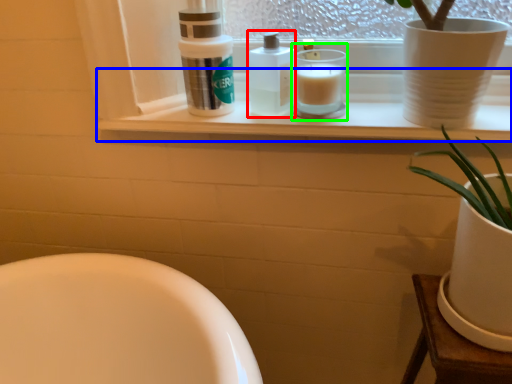
Question: Which object is the farthest from toiletry (highlighted by a red box)? Choose among these: window sill (highlighted by a blue box) or candle holder (highlighted by a green box).

Choices:
 (A) window sill
 (B) candle holder

Answer: (A)